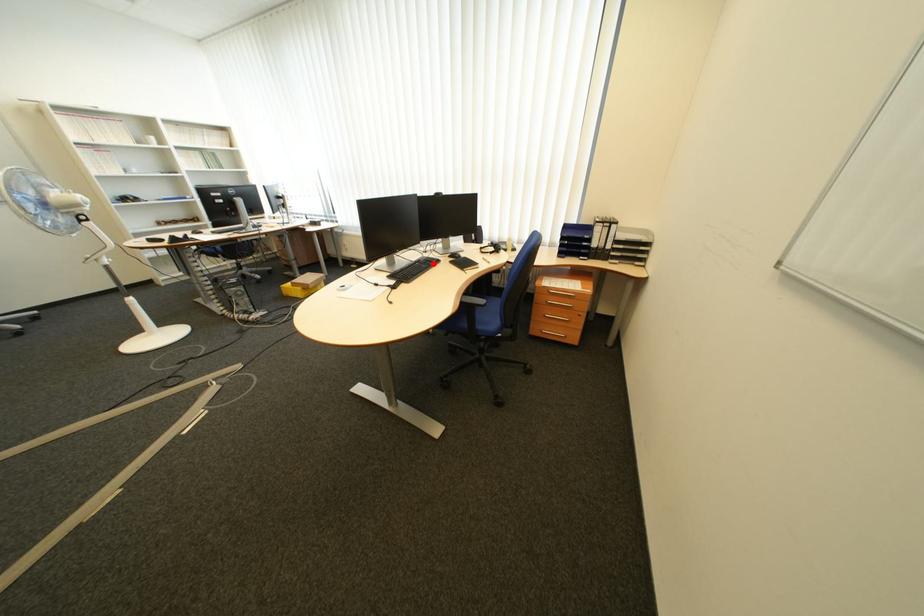
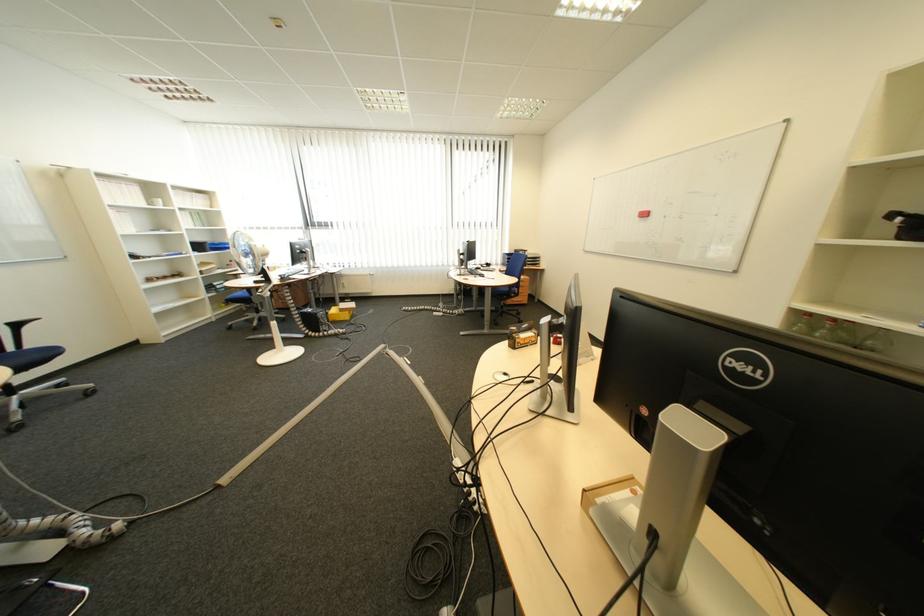
Question: I am providing you with two images of the same scene from different viewpoints. A red point is marked on the first image. Can you still see the location of the red point in image 2?

Choices:
 (A) Yes
 (B) No

Answer: (B)